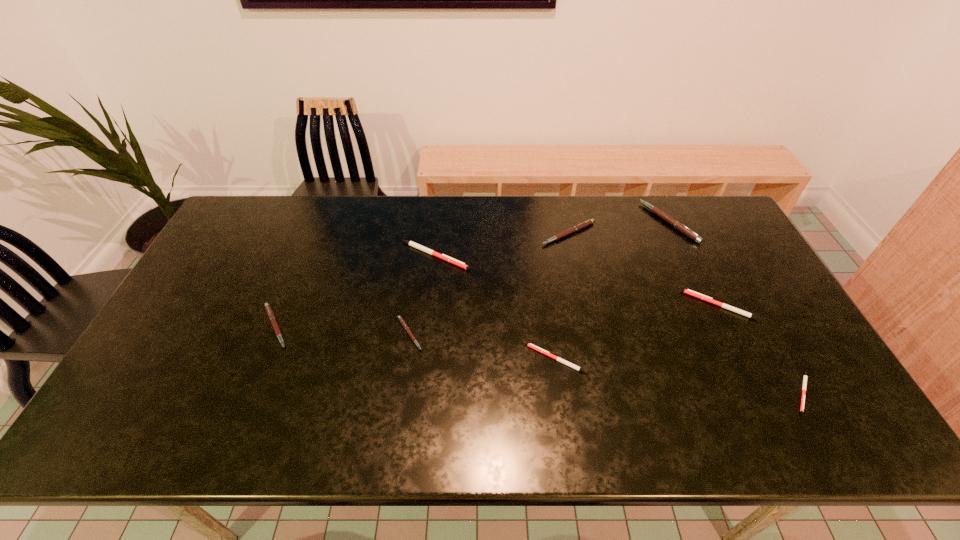
This screenshot has height=540, width=960. Identify the location of the rightmost pink pen. (682, 228).

Find the location of a particular element. The height and width of the screenshot is (540, 960). the tallest object is located at coordinates (682, 228).

What are the coordinates of `the second pink pen from right to left` in the screenshot? It's located at (582, 225).

Identify the location of the farthest white pen. The width and height of the screenshot is (960, 540). (456, 262).

Identify the location of the leftmost white pen. (456, 262).

I want to click on the third biggest pink pen, so click(269, 311).

Where is `the leftmost pink pen`? This screenshot has height=540, width=960. the leftmost pink pen is located at coordinates (269, 311).

You are a GUI agent. You are given a task and a screenshot of the screen. Output one action in this format:
    pyautogui.click(x=<x>, y=<y>)
    Task: Click on the third nearest white pen
    The width and height of the screenshot is (960, 540).
    Given the screenshot: What is the action you would take?
    pyautogui.click(x=688, y=291)

Where is `the third pink pen from right to left`? the third pink pen from right to left is located at coordinates (400, 319).

Locate an element on the screen. the third biggest white pen is located at coordinates (530, 345).